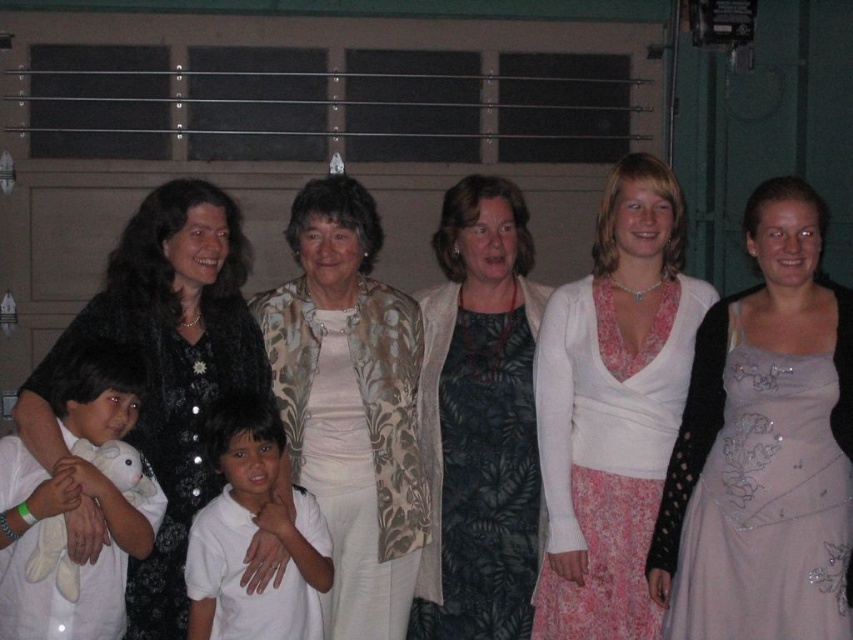
Looking at this image, please look at the image and focus on the point located at coordinates (x=612, y=406). What object in the scene is this point located on?

The point at coordinates (x=612, y=406) is located on the white textured top at center.

You are at a party and want to give the white soft plush toy at left to the person wearing the white smooth shirt at center. Can you hand it directly to them without moving either object?

The white soft plush toy at left is above the white smooth shirt at center, so yes, you can hand it directly to them without moving either object since it is positioned above and reachable.

Looking at this image, you are a photographer setting up for a group photo. You notice the black satin dress at left and the white soft plush toy at left in the scene. Which object should you adjust to ensure both are in focus and properly framed?

You should adjust the white soft plush toy at left because the black satin dress at left is taller than it, so raising the plush toy or lowering the dress could help align their heights for better framing.